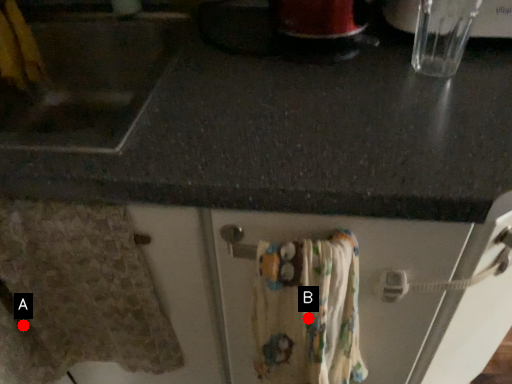
Question: Two points are circled on the image, labeled by A and B beside each circle. Which point appears closest to the camera in this image?

Choices:
 (A) A is closer
 (B) B is closer

Answer: (B)